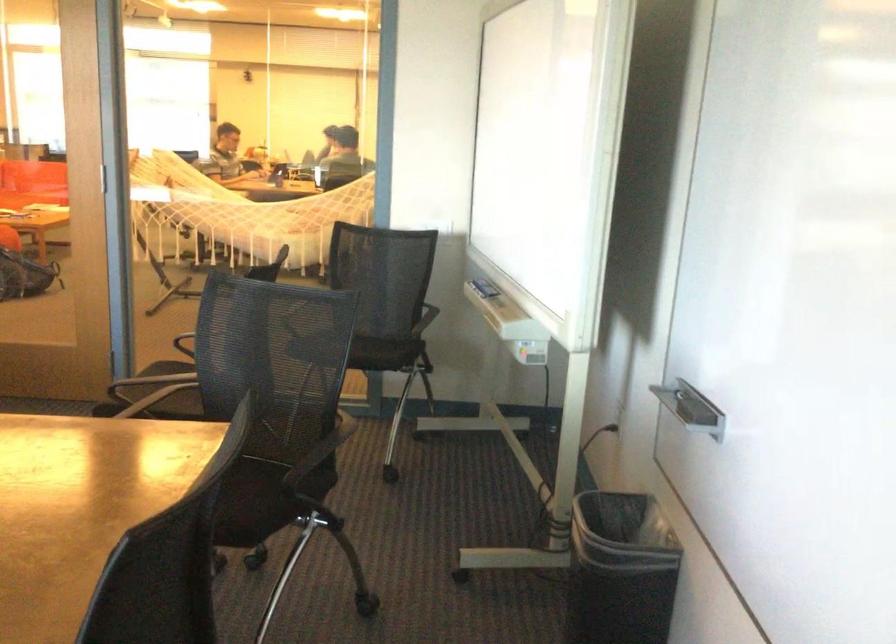
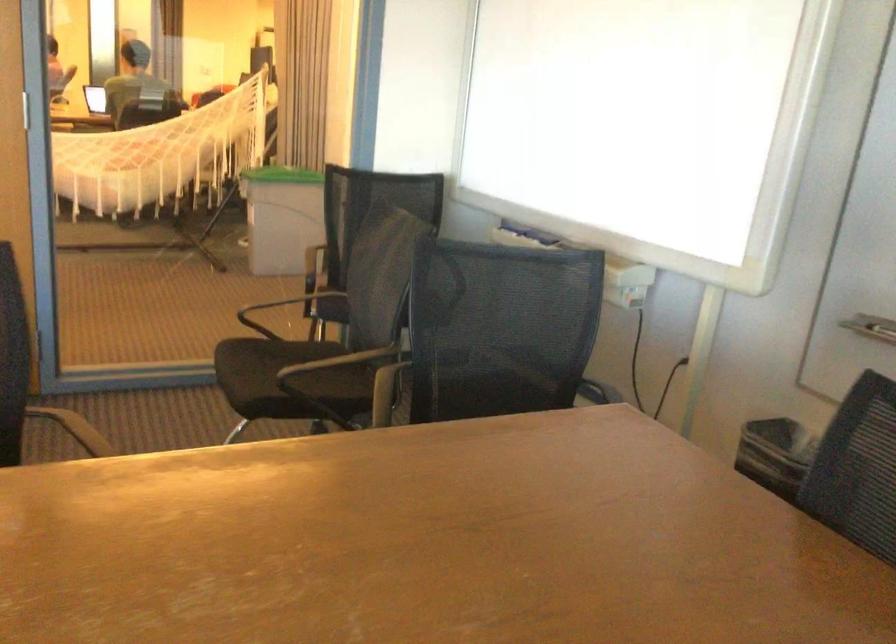
Question: What movement of the cameraman would produce the second image?

Choices:
 (A) Left
 (B) Right
 (C) Forward
 (D) Backward

Answer: (A)